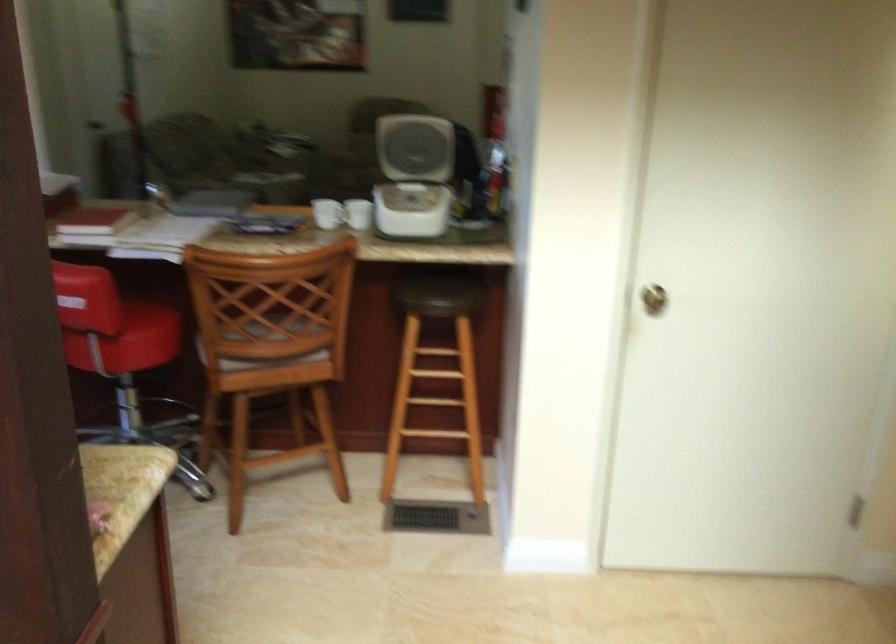
This screenshot has width=896, height=644. Identify the location of wooden chair sitting surface. (271, 341).